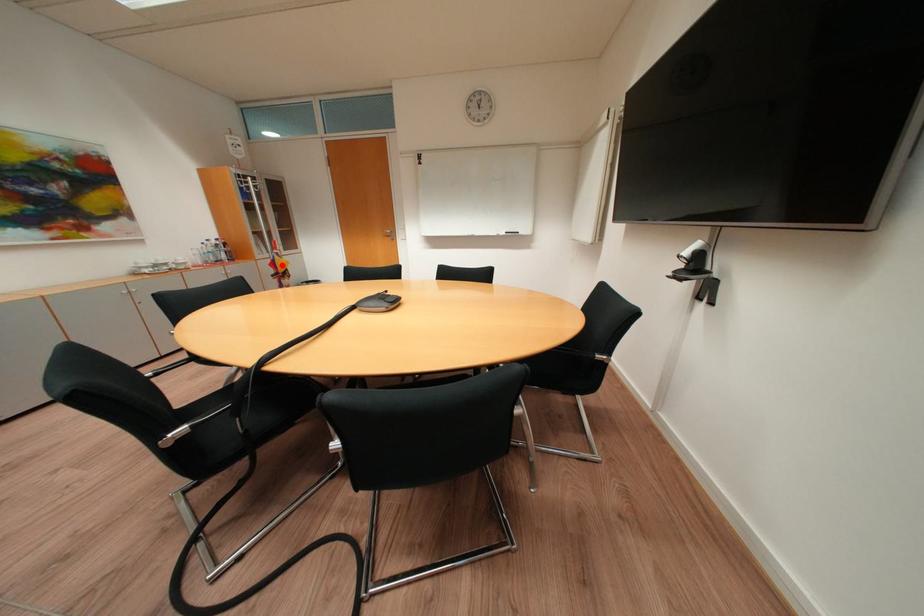
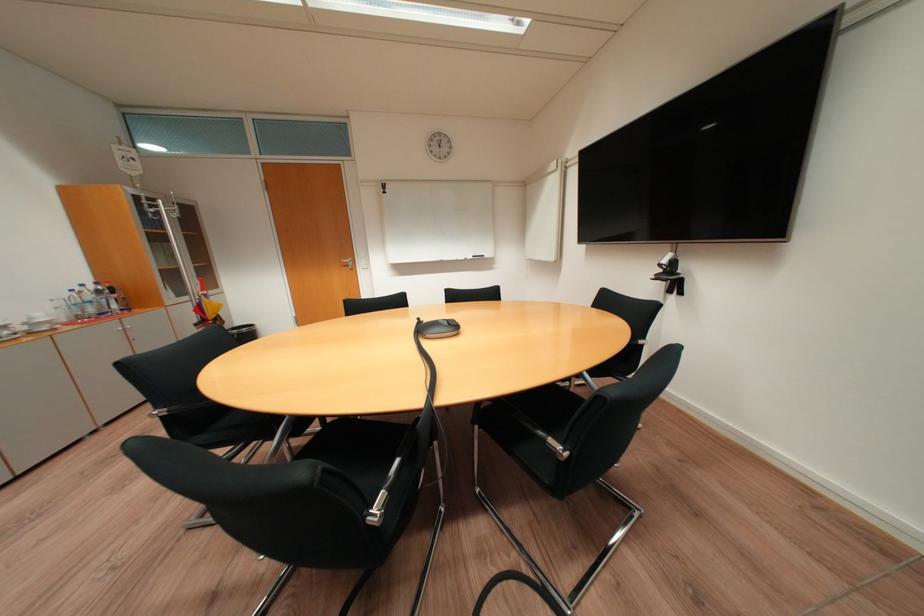
In the second image, find the point that corresponds to the highlighted location in the first image.

(208, 310)